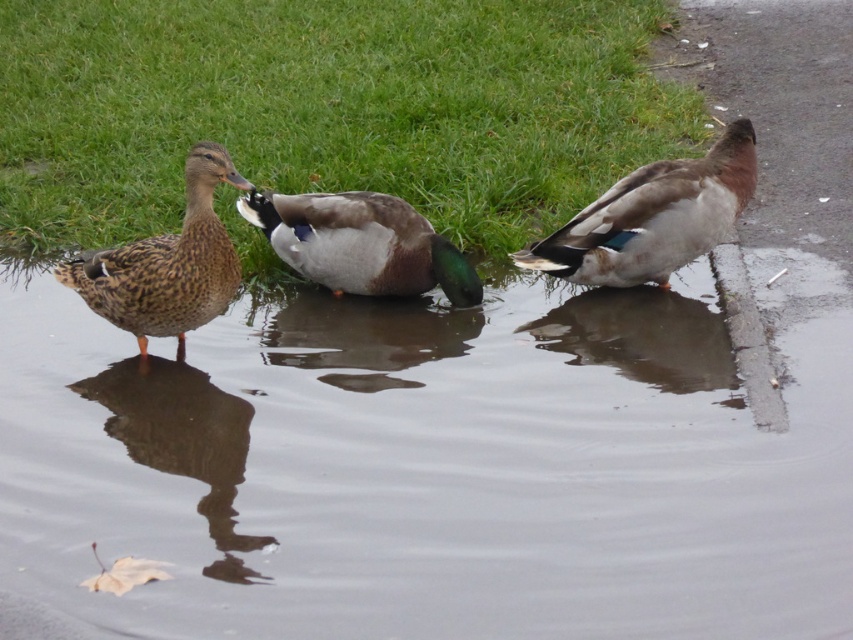
Question: Which object appears farthest from the camera in this image?

Choices:
 (A) green glossy duck at center
 (B) brown speckled duck at left
 (C) green grass at upper center

Answer: (C)

Question: Which is nearer to the green grass at upper center?

Choices:
 (A) brown speckled duck at left
 (B) transparent water at center

Answer: (A)

Question: Is brown speckled duck at left wider than smooth concrete curb at right?

Choices:
 (A) no
 (B) yes

Answer: (B)

Question: Which of these objects is positioned closest to the transparent water at center?

Choices:
 (A) brown speckled duck at left
 (B) smooth concrete curb at right
 (C) brown speckled feathers at right
 (D) green grass at upper center

Answer: (C)

Question: Is transparent water at center smaller than green glossy duck at center?

Choices:
 (A) yes
 (B) no

Answer: (B)

Question: Does green grass at upper center appear under green glossy duck at center?

Choices:
 (A) no
 (B) yes

Answer: (A)